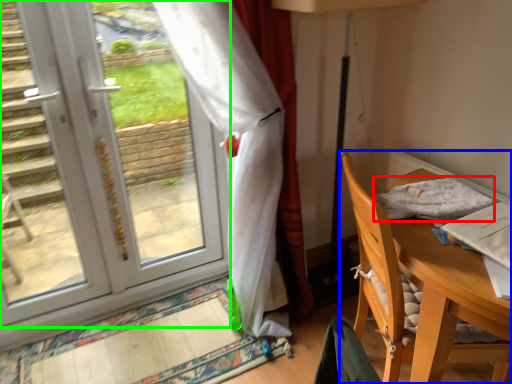
Question: Considering the real-world distances, which object is closest to cloth (highlighted by a red box)? chair (highlighted by a blue box) or door (highlighted by a green box).

Choices:
 (A) chair
 (B) door

Answer: (A)